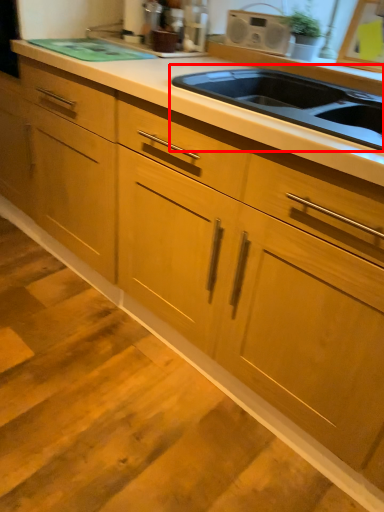
Question: Where is sink (annotated by the red box) located in relation to appliance in the image?

Choices:
 (A) right
 (B) left

Answer: (A)